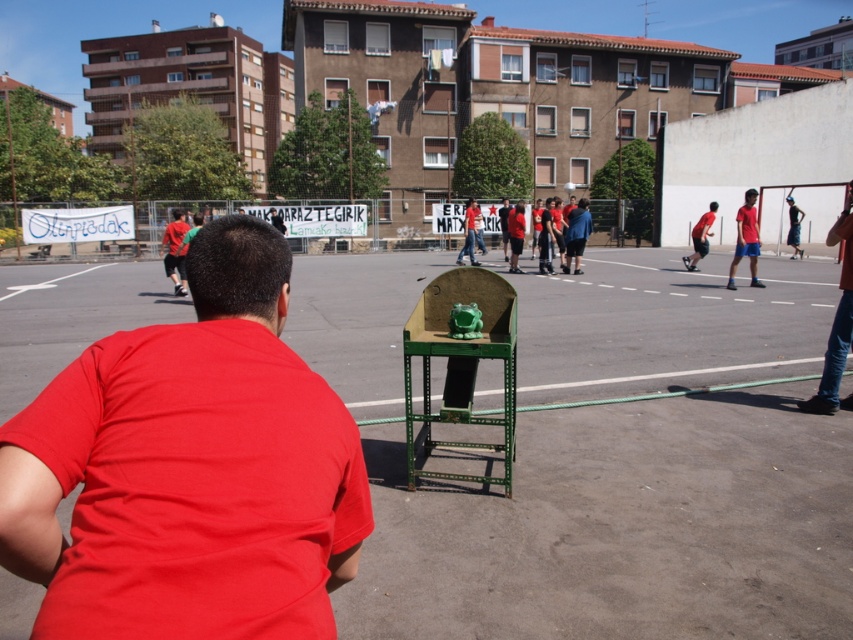
You are a photographer positioned at the far end of the sports court. You need to capture a photo where both the matte red shirt at right and the denim shorts at center are visible in the frame. Based on their positions, which object should be placed closer to the left side of the camera frame?

The matte red shirt at right is to the left of denim shorts at center, so in the camera frame, the matte red shirt at right should be positioned closer to the left side.

You are a photographer positioned at the back of the sports court. You need to take a photo that includes both the red matte shirt at center and the matte red shorts at right. Based on their positions, which object should you adjust your camera angle to focus on first to ensure both are in frame?

The red matte shirt at center is to the left of matte red shorts at right. To capture both in the frame, adjust your camera angle to focus on the red matte shirt at center first, then pan towards the matte red shorts at right since they are positioned to the right of the shirt.

You are a photographer positioned at the back of the sports court. You need to take a photo that includes both the red matte shirt at center and denim shorts at center. According to their positions, which one should be placed on the left side of the photo to ensure both are visible?

The red matte shirt at center should be placed on the left side of the photo because it is already positioned to the left of the denim shorts at center in the scene.